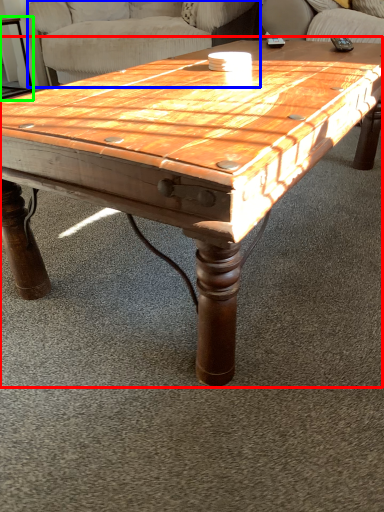
Question: Estimate the real-world distances between objects in this image. Which object is farther from coffee table (highlighted by a red box), swivel chair (highlighted by a blue box) or side table (highlighted by a green box)?

Choices:
 (A) swivel chair
 (B) side table

Answer: (B)